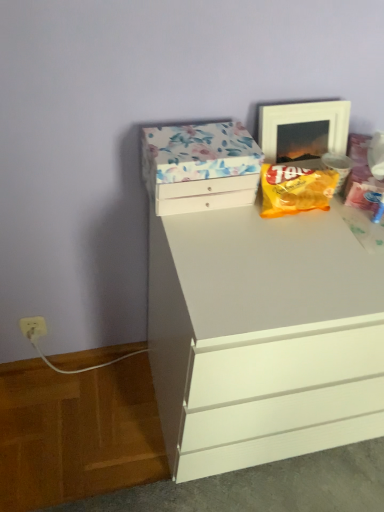
The width and height of the screenshot is (384, 512). In order to click on vacant area located to the right-hand side of yellow matte snack packet at upper right in this screenshot , I will do `click(349, 224)`.